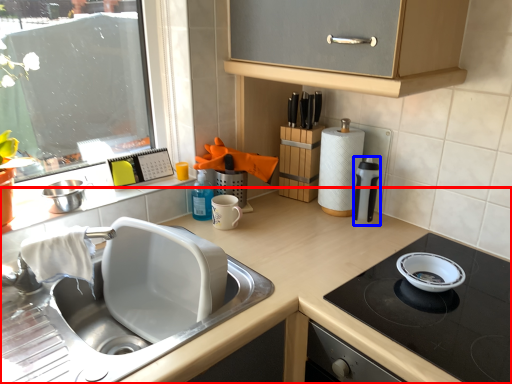
Question: Which object is further to the camera taking this photo, countertop (highlighted by a red box) or kitchen appliance (highlighted by a blue box)?

Choices:
 (A) countertop
 (B) kitchen appliance

Answer: (B)